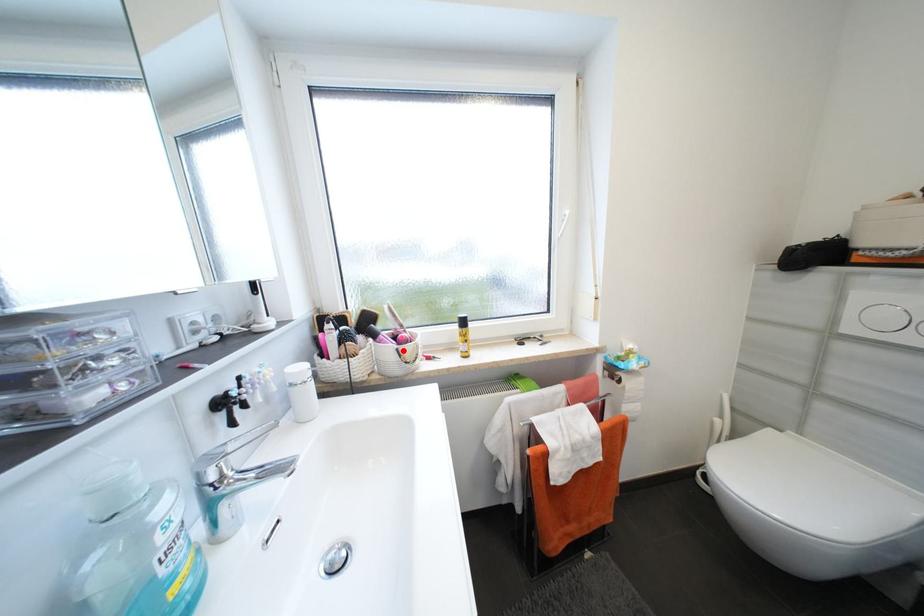
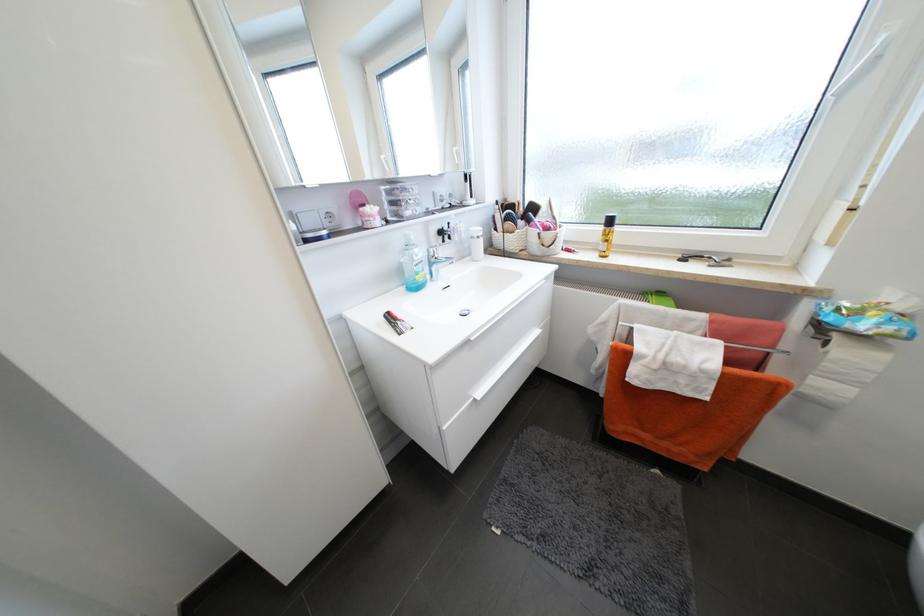
Question: A red point is marked in image1. In image2, is the corresponding 3D point closer to the camera or farther? Reply with the corresponding letter.

Choices:
 (A) The corresponding 3D point is closer.
 (B) The corresponding 3D point is farther.

Answer: (A)